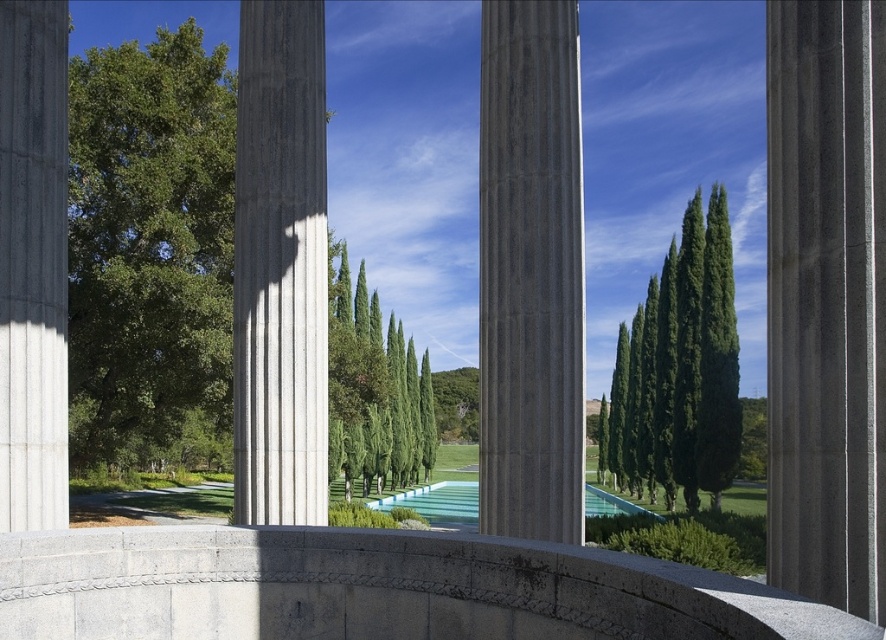
Question: Is smooth concrete pillar at center above smooth concrete column at center?

Choices:
 (A) yes
 (B) no

Answer: (A)

Question: Which object is positioned farthest from the smooth concrete pillar at right?

Choices:
 (A) green leafy tree at left
 (B) smooth concrete pillar at center
 (C) smooth concrete column at left
 (D) green matte tree at right

Answer: (D)

Question: Which of the following is the closest to the observer?

Choices:
 (A) (111, 186)
 (B) (817, 129)
 (C) (518, 496)
 (D) (605, 493)

Answer: (B)

Question: Estimate the real-world distances between objects in this image. Which object is closer to the green leafy tree at left?

Choices:
 (A) smooth concrete column at left
 (B) green matte tree at right
 (C) gray stone bridge at center

Answer: (B)

Question: Is green glossy trees at center wider than clear glass pool at center?

Choices:
 (A) no
 (B) yes

Answer: (A)

Question: Does smooth concrete column at left come in front of green matte tree at right?

Choices:
 (A) no
 (B) yes

Answer: (B)